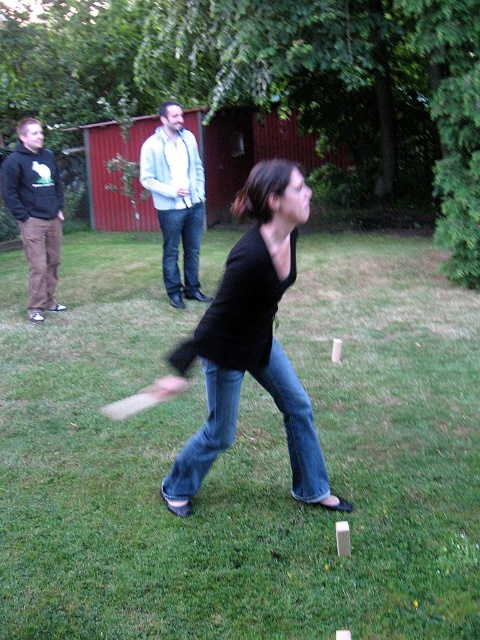
Can you confirm if green grass at center is positioned above light blue denim jeans at center?

No.

Looking at this image, is green grass at center to the right of light blue denim jeans at center from the viewer's perspective?

In fact, green grass at center is to the left of light blue denim jeans at center.

Which is behind, point (362, 381) or point (156, 152)?

Positioned behind is point (156, 152).

Find the location of `green grass at center`. green grass at center is located at coordinates (241, 458).

Between denim jeans at center and blue denim jeans at center, which one is positioned higher?

Positioned higher is blue denim jeans at center.

Is denim jeans at center behind blue denim jeans at center?

No, it is in front of blue denim jeans at center.

What do you see at coordinates (296, 426) in the screenshot? Image resolution: width=480 pixels, height=640 pixels. I see `denim jeans at center` at bounding box center [296, 426].

I want to click on denim jeans at center, so click(296, 426).

Between dark brown hoodie at left and blue denim jeans at center, which one appears on the left side from the viewer's perspective?

From the viewer's perspective, dark brown hoodie at left appears more on the left side.

Is dark brown hoodie at left above blue denim jeans at center?

Yes.

Which is behind, point (45, 288) or point (162, 259)?

The point (162, 259) is behind.

Where is `dark brown hoodie at left`? dark brown hoodie at left is located at coordinates (36, 212).